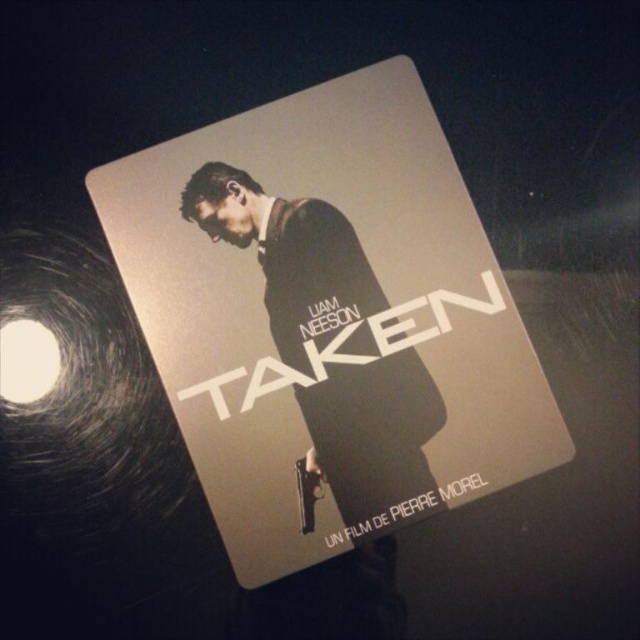
Does metallic silver book at center have a lesser width compared to matte black suit at center?

In fact, metallic silver book at center might be wider than matte black suit at center.

Does metallic silver book at center have a lesser height compared to matte black suit at center?

No, metallic silver book at center is not shorter than matte black suit at center.

What do you see at coordinates (326, 317) in the screenshot? I see `metallic silver book at center` at bounding box center [326, 317].

Locate an element on the screen. metallic silver book at center is located at coordinates (326, 317).